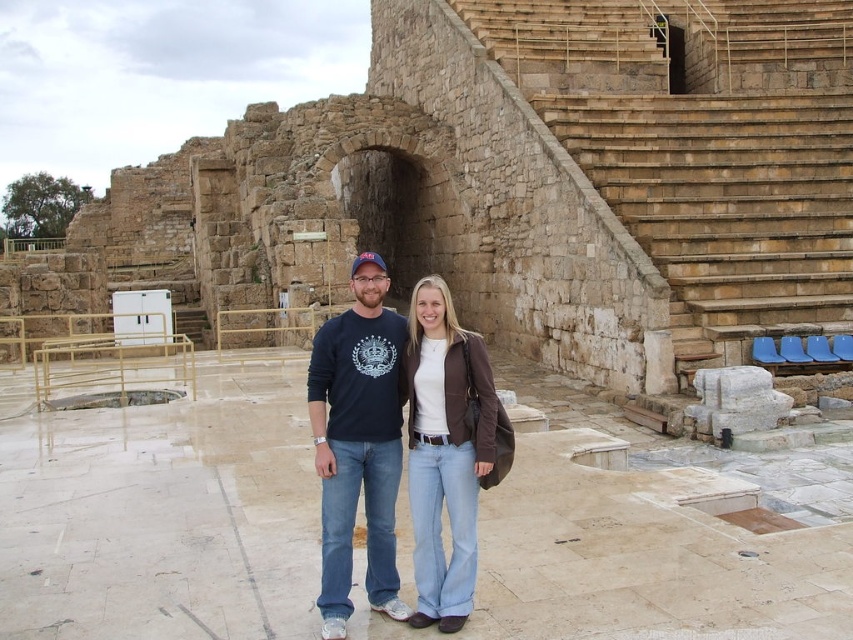
You are a photographer trying to capture a photo of the ancient stone structure. You notice two people wearing a matte blue sweatshirt at center and a brown leather jacket at center. Which person should you ask to move to the right to avoid blocking the view of the arched opening in the background?

You should ask the matte blue sweatshirt at center to move to the right because it is currently on the left side of the brown leather jacket at center, and moving it would create space between them, potentially allowing the arched opening in the background to be visible.

From the picture: You are a photographer setting up a shoot at the ancient stone structure. You have two outfits to choose from for the shoot. The matte blue sweatshirt at center and the brown leather jacket at center. If you want to ensure the outfit is more noticeable in the image, which one should you choose?

The matte blue sweatshirt at center is bigger than the brown leather jacket at center, so the matte blue sweatshirt at center would be more noticeable in the image.